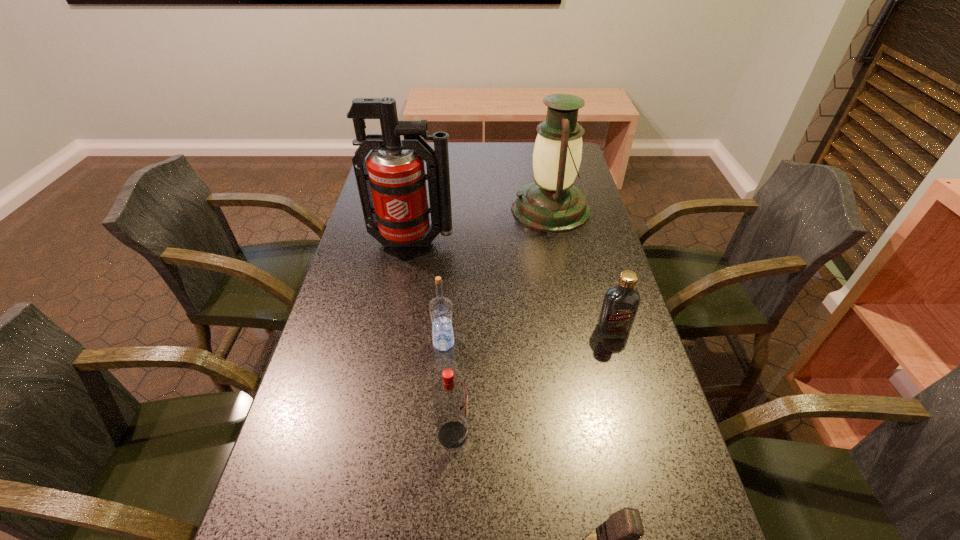
Find the location of `free spot that satisfies the following two spatial constraints: 1. with the light compartment facing forward on the lantern; 2. on the front label side of the tallest object`. free spot that satisfies the following two spatial constraints: 1. with the light compartment facing forward on the lantern; 2. on the front label side of the tallest object is located at coordinates (558, 242).